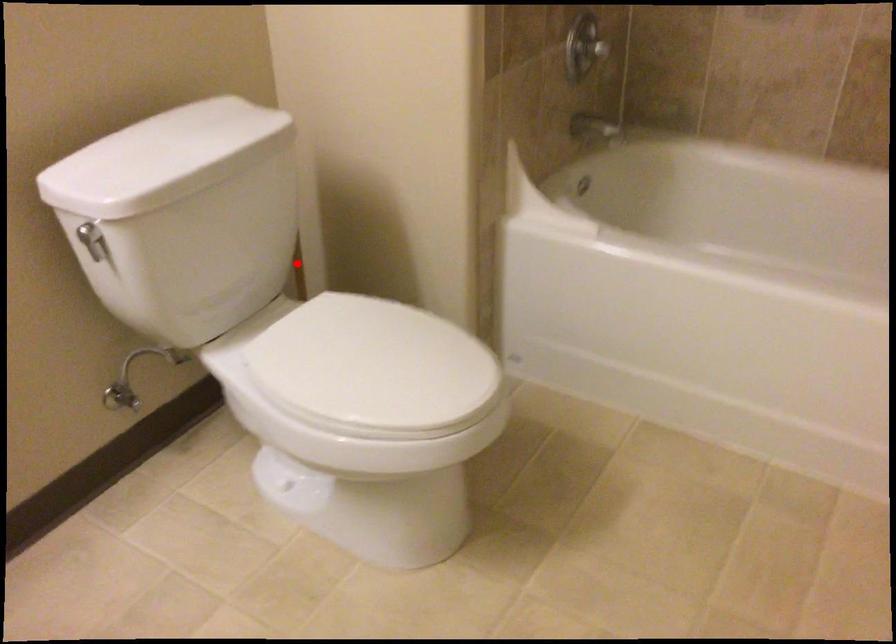
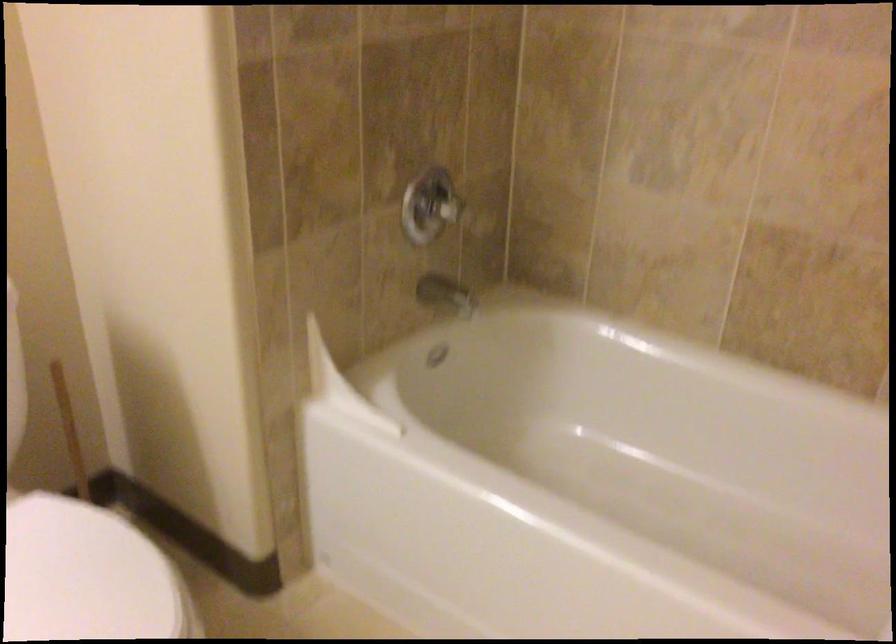
Locate, in the second image, the point that corresponds to the highlighted location in the first image.

(72, 438)